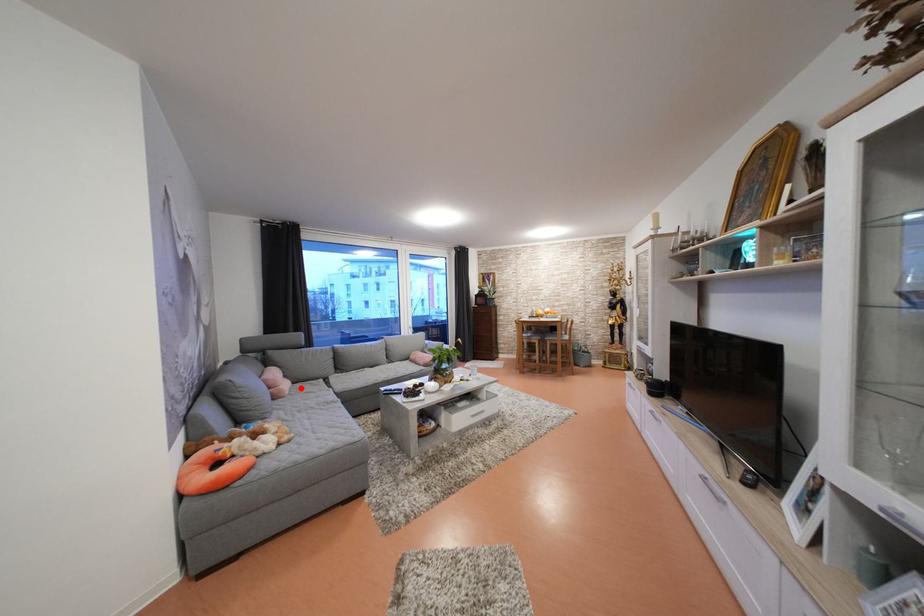
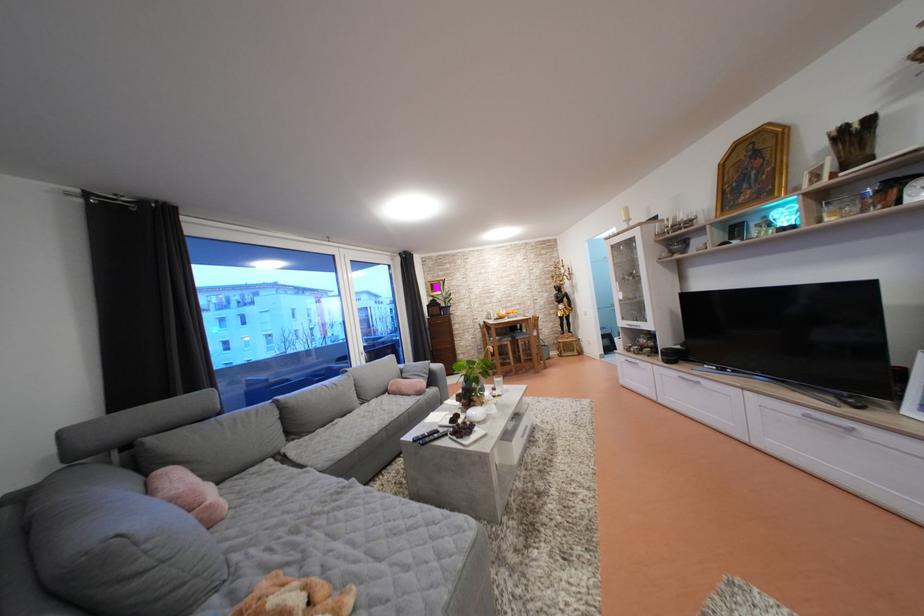
Where in the second image is the point corresponding to the highlighted location from the first image?

(225, 488)